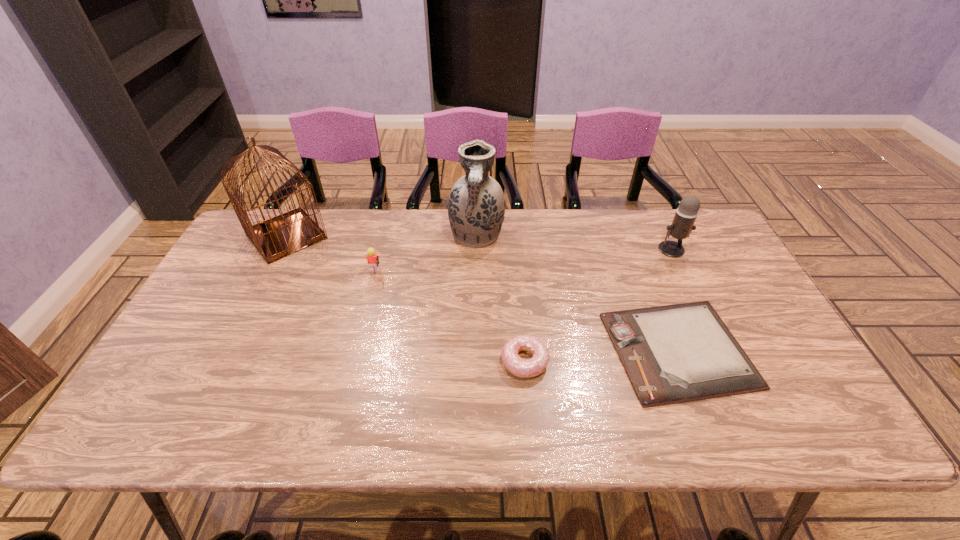
Identify the location of empty space between the third tallest object and the doughnut. The width and height of the screenshot is (960, 540). (598, 305).

The width and height of the screenshot is (960, 540). What are the coordinates of `free space between the third shortest object and the vase` in the screenshot? It's located at (425, 255).

Identify the location of free space that is in between the vase and the doughnut. (500, 299).

The image size is (960, 540). In order to click on vacant area that lies between the shortest object and the third tallest object in this screenshot , I will do `click(675, 300)`.

Identify the location of vacant region between the vase and the shortest object. (577, 293).

At what (x,y) coordinates should I click in order to perform the action: click on blank region between the second object from left to right and the vase. Please return your answer as a coordinate pair (x, y). Image resolution: width=960 pixels, height=540 pixels. Looking at the image, I should click on (425, 255).

Locate an element on the screen. This screenshot has width=960, height=540. empty space between the doughnut and the third tallest object is located at coordinates (598, 305).

Identify which object is located as the second nearest to the shortest object. Please provide its 2D coordinates. Your answer should be formatted as a tuple, i.e. [(x, y)], where the tuple contains the x and y coordinates of a point satisfying the conditions above.

[(682, 225)]

Locate which object is the fourth closest to the fourth farthest object. Please provide its 2D coordinates. Your answer should be formatted as a tuple, i.e. [(x, y)], where the tuple contains the x and y coordinates of a point satisfying the conditions above.

[(677, 353)]

Locate an element on the screen. free space that satisfies the following two spatial constraints: 1. on the front side of the birdcage; 2. on the left side of the second shortest object is located at coordinates (224, 361).